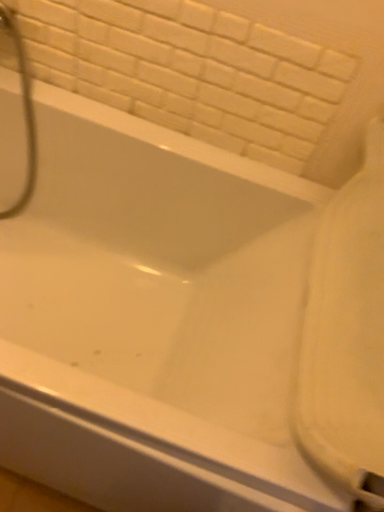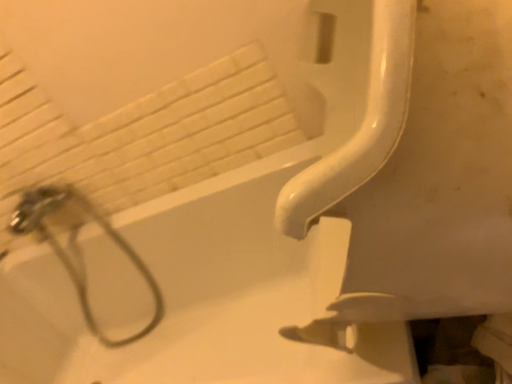
Question: Which way did the camera rotate in the video?

Choices:
 (A) rotated left
 (B) rotated right

Answer: (A)